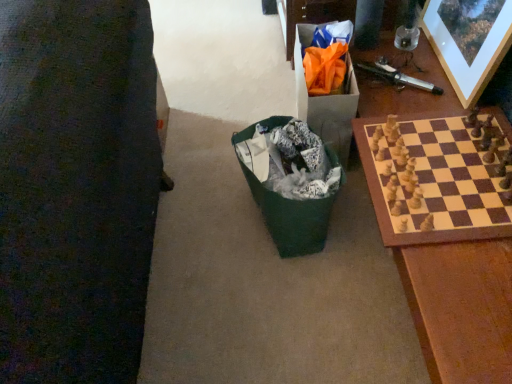
I want to click on vacant region above orange paper bag at upper right (from a real-world perspective), so click(327, 58).